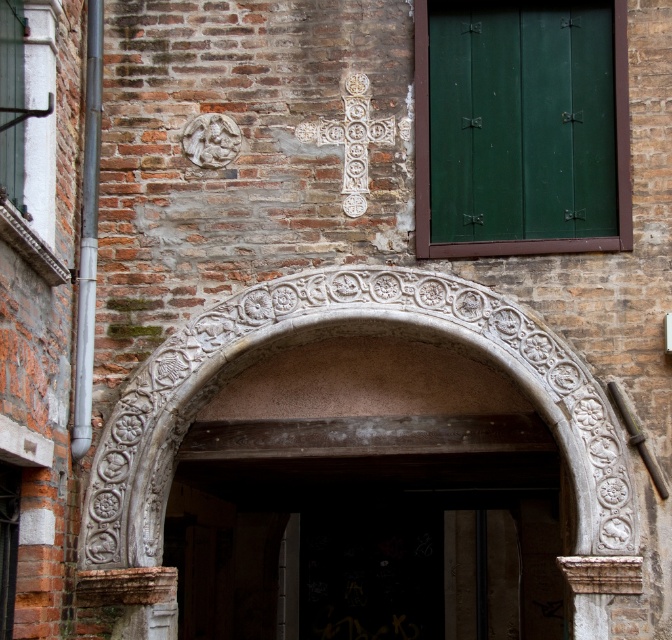
Is white stone archway at center thinner than green matte door at upper right?

Yes, white stone archway at center is thinner than green matte door at upper right.

Who is more forward, (179, 353) or (577, 67)?

Positioned in front is point (179, 353).

Image resolution: width=672 pixels, height=640 pixels. I want to click on white stone archway at center, so 347,332.

Does carved stone archway at center have a lesser height compared to green matte door at upper right?

No.

Does carved stone archway at center have a larger size compared to green matte door at upper right?

Yes.

Measure the distance between point (495, 541) and camera.

39.09 meters

Where is `carved stone archway at center`? The height and width of the screenshot is (640, 672). carved stone archway at center is located at coordinates (368, 547).

Is carved stone archway at center positioned behind white stone archway at center?

Yes, carved stone archway at center is further from the viewer.

You are a GUI agent. You are given a task and a screenshot of the screen. Output one action in this format:
    pyautogui.click(x=<x>, y=<y>)
    Task: Click on the carved stone archway at center
    This screenshot has height=640, width=672.
    Given the screenshot: What is the action you would take?
    pyautogui.click(x=368, y=547)

This screenshot has width=672, height=640. Describe the element at coordinates (368, 547) in the screenshot. I see `carved stone archway at center` at that location.

I want to click on carved stone archway at center, so click(368, 547).